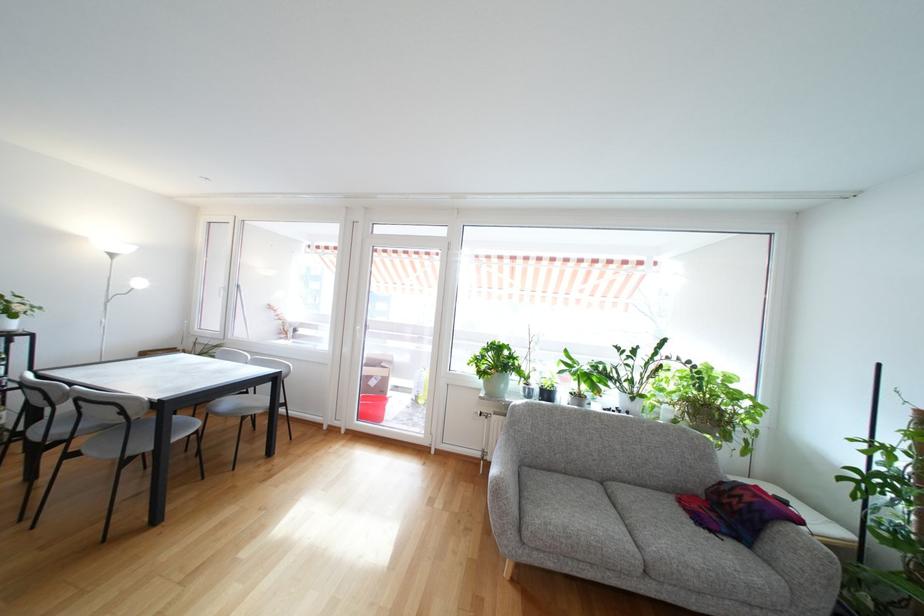
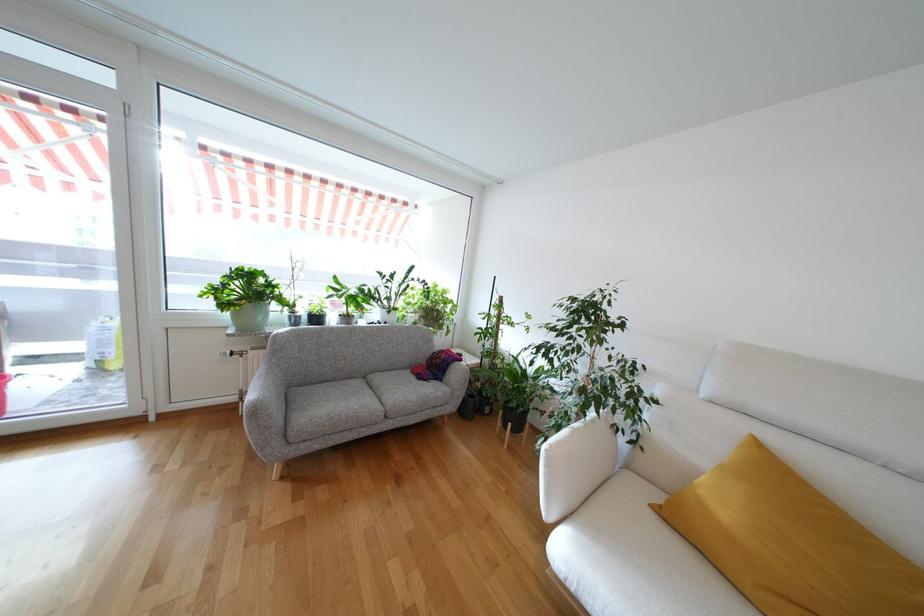
In the second image, find the point that corresponds to (x=476, y=367) in the first image.

(212, 300)